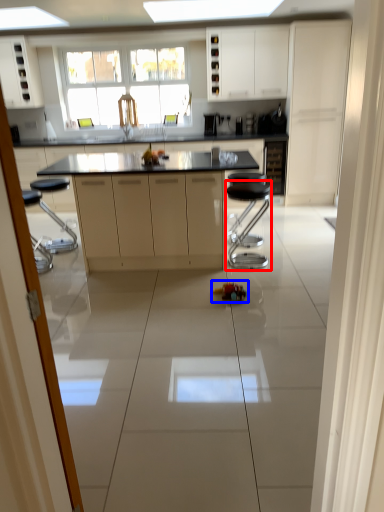
Question: Which object is further to the camera taking this photo, bar stool (highlighted by a red box) or toy (highlighted by a blue box)?

Choices:
 (A) bar stool
 (B) toy

Answer: (A)